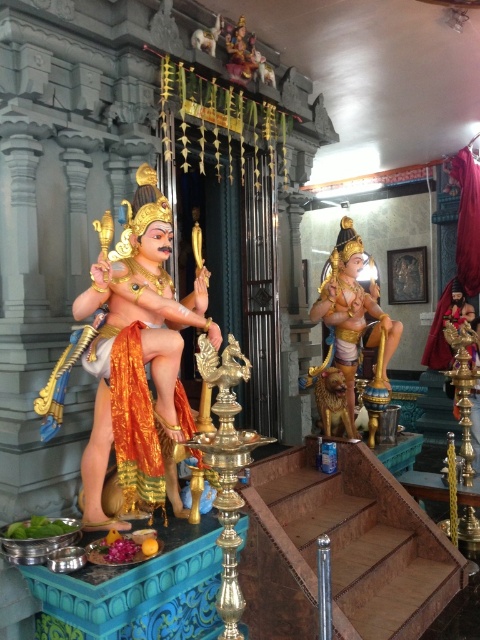
Question: Is goldmaterial/texture statue at center positioned in front of gold metallic statue at center?

Choices:
 (A) yes
 (B) no

Answer: (A)

Question: Can you confirm if goldmaterial/texture statue at center is thinner than gold metallic statue at center?

Choices:
 (A) yes
 (B) no

Answer: (A)

Question: Does goldmaterial/texture statue at center have a larger size compared to gold metallic statue at center?

Choices:
 (A) yes
 (B) no

Answer: (A)

Question: Which of the following is the farthest from the observer?

Choices:
 (A) goldmaterial/texture statue at center
 (B) gold metallic statue at center

Answer: (B)